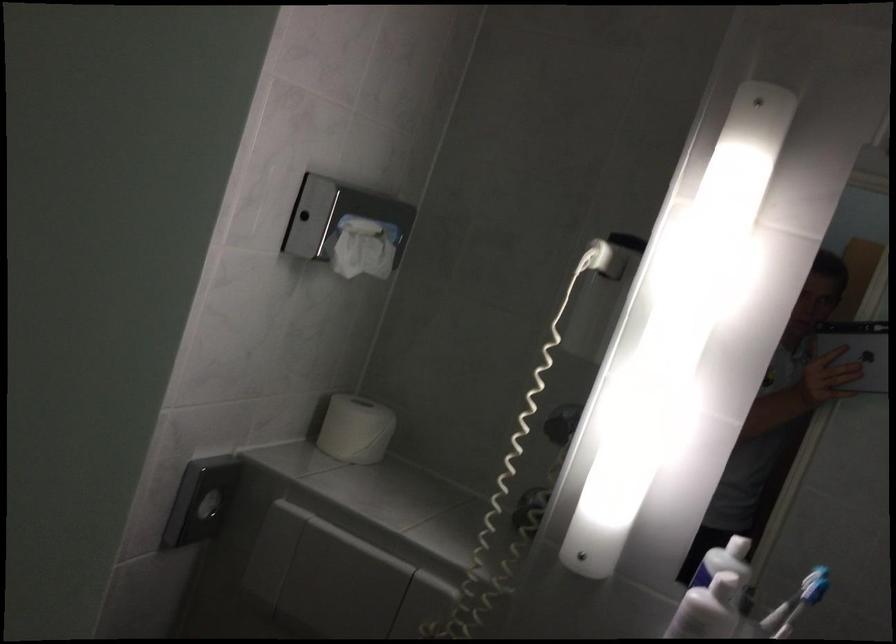
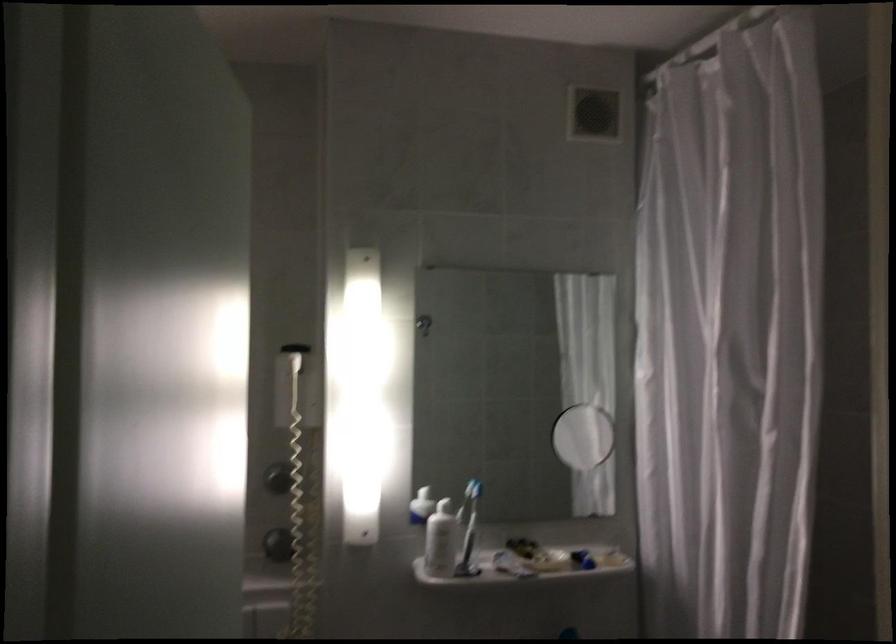
Question: I am providing you with two images of the same scene from different viewpoints. Which of the following objects are not visible in image2?

Choices:
 (A) dispenser pump head
 (B) maroon round case
 (C) round wall knob
 (D) silver tablet

Answer: (D)